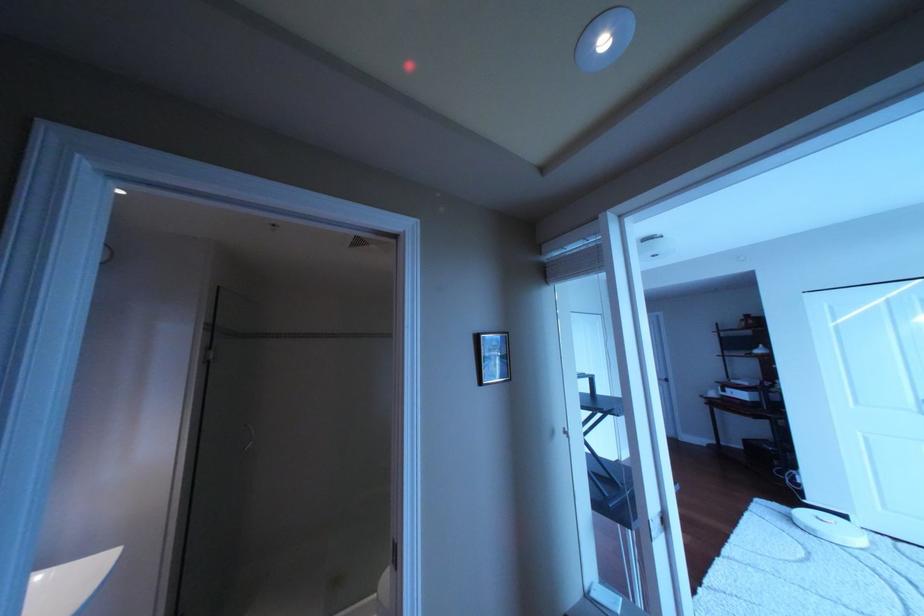
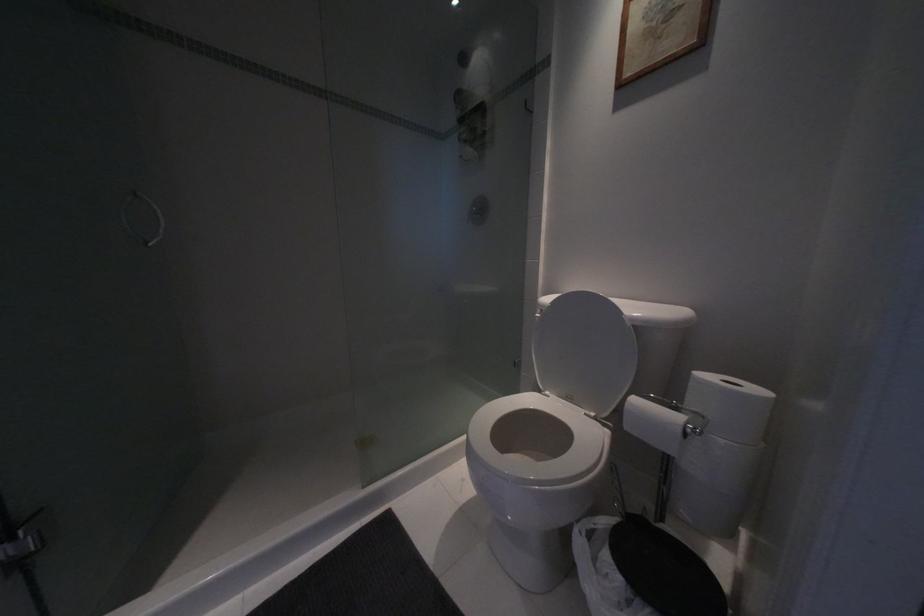
In a continuous first-person perspective shot, in which direction is the camera moving?

The cameraman moved toward left, forward.